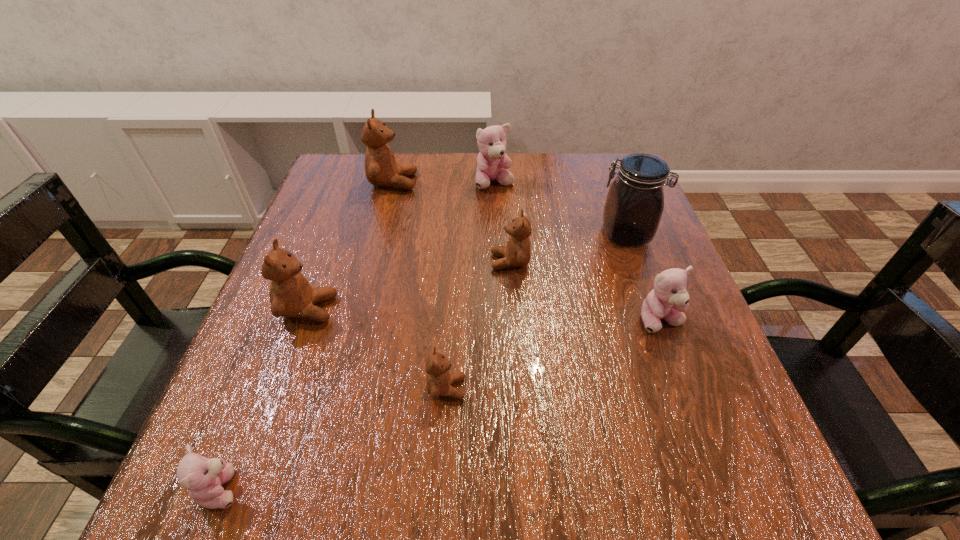
At what (x,y) coordinates should I click in order to perform the action: click on object that is at the near left corner. Please return your answer as a coordinate pair (x, y). The width and height of the screenshot is (960, 540). Looking at the image, I should click on (203, 478).

I want to click on vacant space at the far edge of the desktop, so click(x=486, y=196).

This screenshot has height=540, width=960. Identify the location of free point at the near edge. 570,460.

Find the location of `vacant space at the left edge`. vacant space at the left edge is located at coordinates (238, 374).

This screenshot has height=540, width=960. I want to click on free region at the right edge, so click(x=646, y=402).

In order to click on empty space that is in between the biggest brown teddy bear and the third farthest brown teddy bear in this screenshot , I will do `click(350, 246)`.

Identify the location of free space between the third smallest brown teddy bear and the biggest brown teddy bear. This screenshot has width=960, height=540. (350, 246).

Where is `unoccupied area between the leftmost pink teddy bear and the rightmost teddy bear`? The image size is (960, 540). unoccupied area between the leftmost pink teddy bear and the rightmost teddy bear is located at coordinates (441, 404).

Locate an element on the screen. The height and width of the screenshot is (540, 960). unoccupied position between the biggest pink teddy bear and the second biggest pink teddy bear is located at coordinates (578, 252).

Locate an element on the screen. free area in between the jar and the farthest pink teddy bear is located at coordinates (560, 208).